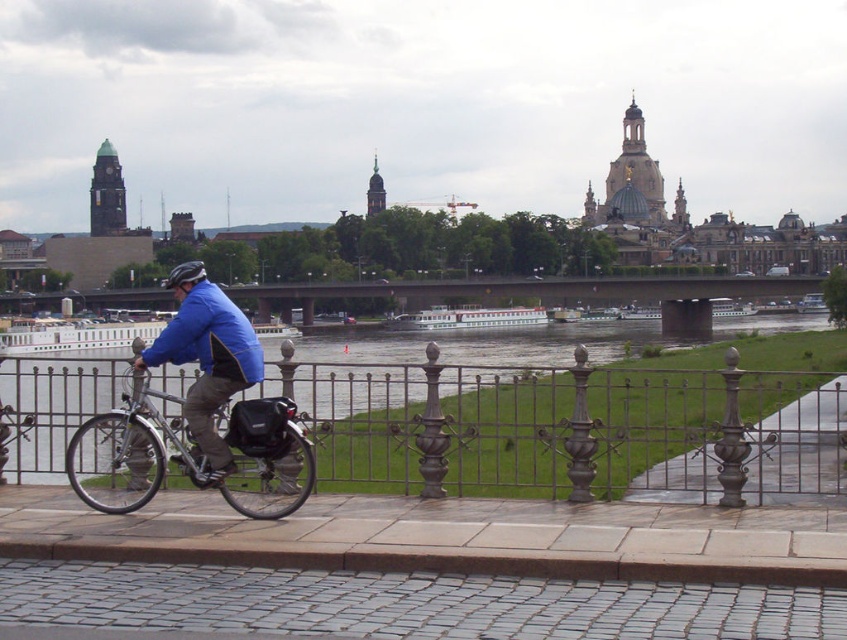
Question: Which point is closer to the camera?

Choices:
 (A) blue matte jacket at center
 (B) silver metallic bicycle at center
 (C) shiny black helmet at center
 (D) metallic iron fence at center

Answer: (B)

Question: Is silver metallic bicycle at center below blue matte jacket at center?

Choices:
 (A) yes
 (B) no

Answer: (A)

Question: Does metallic iron fence at center have a greater width compared to blue matte jacket at center?

Choices:
 (A) no
 (B) yes

Answer: (B)

Question: Can you confirm if metallic iron fence at center is thinner than shiny black helmet at center?

Choices:
 (A) yes
 (B) no

Answer: (A)

Question: Which point is farther to the camera?

Choices:
 (A) (285, 417)
 (B) (161, 349)

Answer: (B)

Question: Which point is closer to the camera?

Choices:
 (A) (198, 381)
 (B) (250, 470)
 (C) (186, 275)
 (D) (419, 396)

Answer: (B)